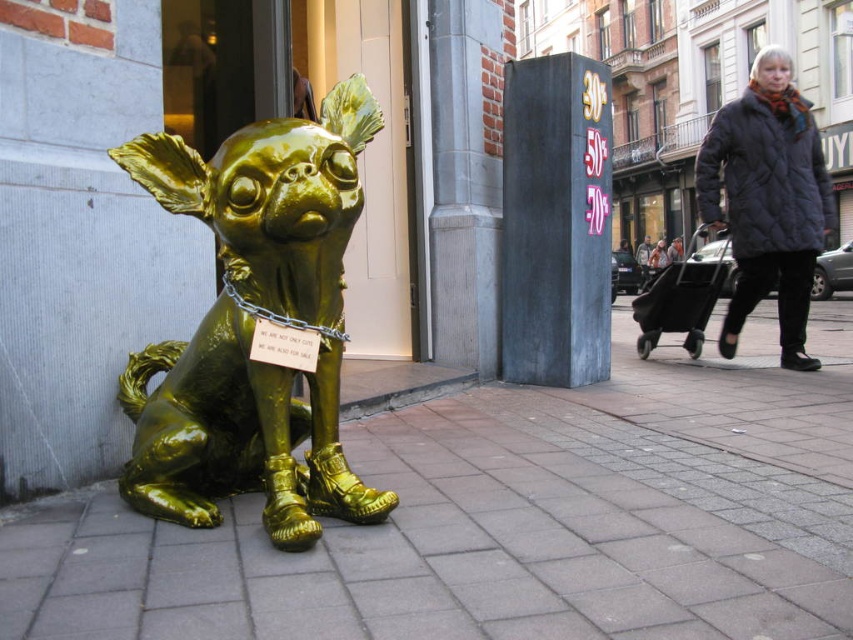
Question: Is dark blue quilted jacket at right above gold metallic chain at center?

Choices:
 (A) no
 (B) yes

Answer: (B)

Question: Based on their relative distances, which object is nearer to the glossy gold dog at left?

Choices:
 (A) glossy pavement at lower center
 (B) gold metallic chain at center
 (C) dark blue quilted jacket at right

Answer: (B)

Question: Which of the following is the closest to the observer?

Choices:
 (A) gold metallic chain at center
 (B) dark blue quilted jacket at right
 (C) glossy pavement at lower center

Answer: (C)

Question: Which of these objects is positioned closest to the dark blue quilted jacket at right?

Choices:
 (A) glossy gold dog at left
 (B) glossy pavement at lower center

Answer: (B)

Question: Is glossy gold dog at left above gold metallic chain at center?

Choices:
 (A) yes
 (B) no

Answer: (A)

Question: Does glossy gold dog at left appear on the right side of gold metallic chain at center?

Choices:
 (A) no
 (B) yes

Answer: (A)